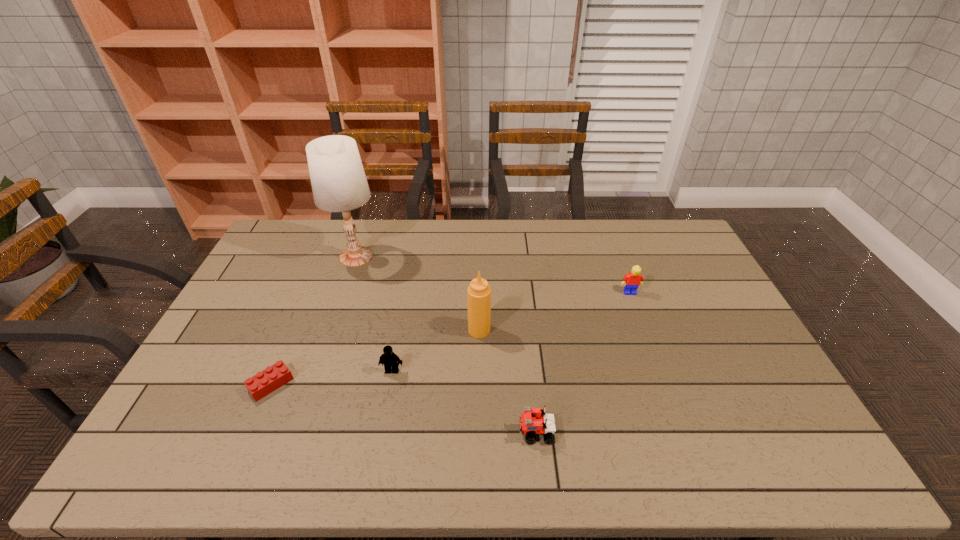
Find the location of a particular element. The height and width of the screenshot is (540, 960). the shortest Lego is located at coordinates (273, 377).

At what (x,y) coordinates should I click in order to perform the action: click on blank space located 0.390m on the right of the tallest object. Please return your answer as a coordinate pair (x, y). Image resolution: width=960 pixels, height=540 pixels. Looking at the image, I should click on (488, 257).

Locate an element on the screen. free region located 0.230m on the right of the third farthest object is located at coordinates (565, 330).

This screenshot has width=960, height=540. Find the location of `free space located 0.360m on the front-facing side of the farthest Lego`. free space located 0.360m on the front-facing side of the farthest Lego is located at coordinates (665, 387).

Find the location of a particular element. vacant space located 0.260m on the face of the second Lego from left to right is located at coordinates (374, 467).

At what (x,y) coordinates should I click in order to perform the action: click on vacant space located 0.310m on the front-facing side of the second object from right to left. Please return your answer as a coordinate pair (x, y). This screenshot has width=960, height=540. Looking at the image, I should click on (394, 432).

This screenshot has width=960, height=540. I want to click on vacant space located on the front-facing side of the second object from right to left, so click(361, 432).

This screenshot has height=540, width=960. In order to click on vacant space located on the front-facing side of the second object from right to left in this screenshot , I will do `click(491, 432)`.

Identify the location of free location located on the right of the leftmost Lego. This screenshot has height=540, width=960. (406, 384).

The image size is (960, 540). What are the coordinates of `object that is at the far edge` in the screenshot? It's located at (339, 184).